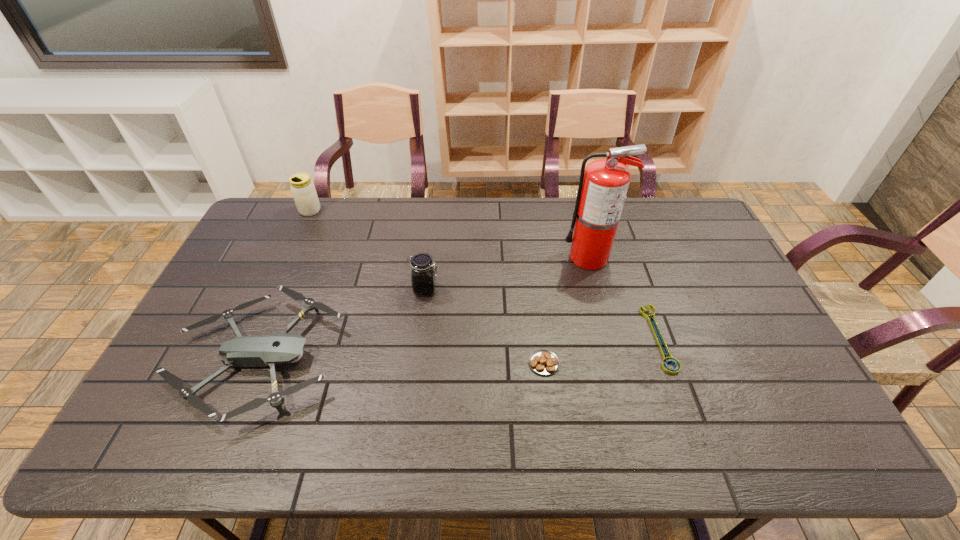
The height and width of the screenshot is (540, 960). In order to click on the fourth closest object to the second shortest object in this screenshot , I will do `click(268, 350)`.

What are the coordinates of `vacant area in the image that satisfies the following two spatial constraints: 1. on the front side of the shortest object; 2. on the left side of the farthest object` in the screenshot? It's located at (252, 338).

Where is `vacant space that satisfies the following two spatial constraints: 1. with a camera mounted on the front of the third shortest object; 2. on the left side of the fifth tallest object`? vacant space that satisfies the following two spatial constraints: 1. with a camera mounted on the front of the third shortest object; 2. on the left side of the fifth tallest object is located at coordinates (255, 363).

This screenshot has width=960, height=540. I want to click on vacant space that satisfies the following two spatial constraints: 1. on the front side of the farther jar; 2. on the left side of the pastry, so click(x=241, y=363).

The image size is (960, 540). What are the coordinates of `blank space that satisfies the following two spatial constraints: 1. on the lid of the wrench; 2. on the right side of the nearer jar` in the screenshot? It's located at (420, 338).

Where is `vacant region that satisfies the following two spatial constraints: 1. on the front side of the rightmost object; 2. on the left side of the farther jar`? vacant region that satisfies the following two spatial constraints: 1. on the front side of the rightmost object; 2. on the left side of the farther jar is located at coordinates (252, 338).

Image resolution: width=960 pixels, height=540 pixels. I want to click on vacant area in the image that satisfies the following two spatial constraints: 1. on the back side of the second shortest object; 2. on the left side of the rightmost object, so click(540, 338).